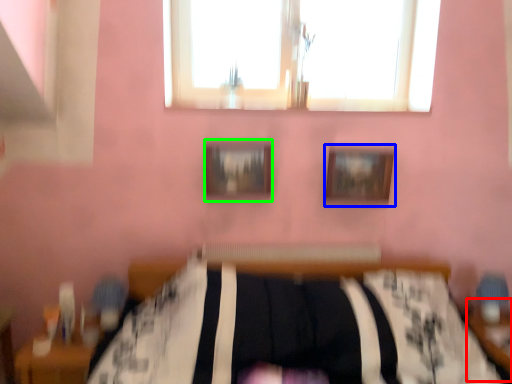
Question: Based on their relative distances, which object is farther from table (highlighted by a red box)? Choose from picture frame (highlighted by a blue box) and picture frame (highlighted by a green box).

Choices:
 (A) picture frame
 (B) picture frame

Answer: (B)